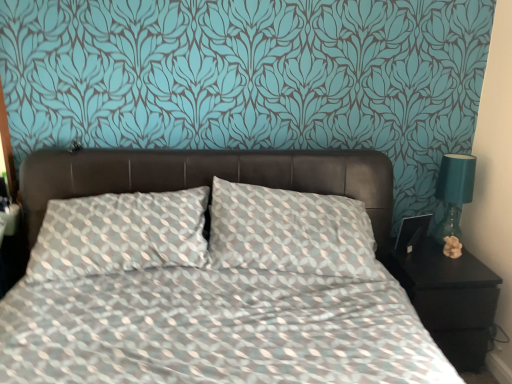
Question: Considering the relative sizes of black glossy nightstand at lower right and matte beige figurine at right in the image provided, is black glossy nightstand at lower right wider than matte beige figurine at right?

Choices:
 (A) yes
 (B) no

Answer: (A)

Question: Considering the relative sizes of black glossy nightstand at lower right and matte beige figurine at right in the image provided, is black glossy nightstand at lower right shorter than matte beige figurine at right?

Choices:
 (A) no
 (B) yes

Answer: (A)

Question: Considering the relative sizes of black glossy nightstand at lower right and matte beige figurine at right in the image provided, is black glossy nightstand at lower right thinner than matte beige figurine at right?

Choices:
 (A) yes
 (B) no

Answer: (B)

Question: Does black glossy nightstand at lower right appear on the right side of matte beige figurine at right?

Choices:
 (A) no
 (B) yes

Answer: (A)

Question: Is black glossy nightstand at lower right to the left of matte beige figurine at right from the viewer's perspective?

Choices:
 (A) yes
 (B) no

Answer: (A)

Question: Are black glossy nightstand at lower right and matte beige figurine at right beside each other?

Choices:
 (A) yes
 (B) no

Answer: (B)

Question: From the image's perspective, is matte beige figurine at right located beneath black glossy nightstand at lower right?

Choices:
 (A) no
 (B) yes

Answer: (A)

Question: Is matte beige figurine at right wider than black glossy nightstand at lower right?

Choices:
 (A) yes
 (B) no

Answer: (B)

Question: Could you tell me if matte beige figurine at right is turned towards black glossy nightstand at lower right?

Choices:
 (A) yes
 (B) no

Answer: (B)

Question: Does matte beige figurine at right appear on the left side of black glossy nightstand at lower right?

Choices:
 (A) no
 (B) yes

Answer: (A)

Question: Is matte beige figurine at right in front of black glossy nightstand at lower right?

Choices:
 (A) no
 (B) yes

Answer: (A)

Question: From a real-world perspective, is matte beige figurine at right physically below black glossy nightstand at lower right?

Choices:
 (A) no
 (B) yes

Answer: (A)

Question: Does teal glass lamp at right have a lesser height compared to black glossy nightstand at lower right?

Choices:
 (A) no
 (B) yes

Answer: (B)